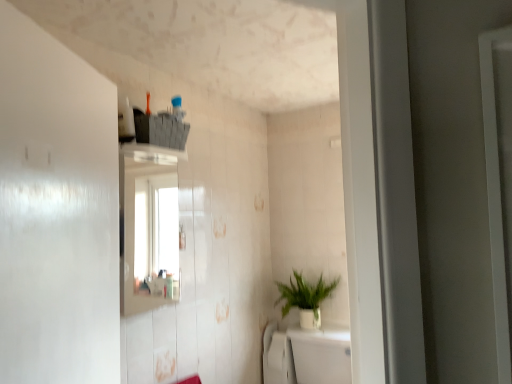
Question: In terms of width, does green matte plant at center look wider or thinner when compared to white glossy bath at lower center?

Choices:
 (A) wide
 (B) thin

Answer: (B)

Question: Would you say green matte plant at center is to the left or to the right of white glossy bath at lower center in the picture?

Choices:
 (A) left
 (B) right

Answer: (A)

Question: From the image's perspective, is green matte plant at center above or below white glossy bath at lower center?

Choices:
 (A) below
 (B) above

Answer: (B)

Question: From the image's perspective, is white glossy bath at lower center above or below green matte plant at center?

Choices:
 (A) below
 (B) above

Answer: (A)

Question: From their relative heights in the image, would you say white glossy bath at lower center is taller or shorter than green matte plant at center?

Choices:
 (A) tall
 (B) short

Answer: (A)

Question: Is white glossy bath at lower center bigger or smaller than green matte plant at center?

Choices:
 (A) small
 (B) big

Answer: (B)

Question: In the image, is white glossy bath at lower center on the left side or the right side of green matte plant at center?

Choices:
 (A) left
 (B) right

Answer: (B)